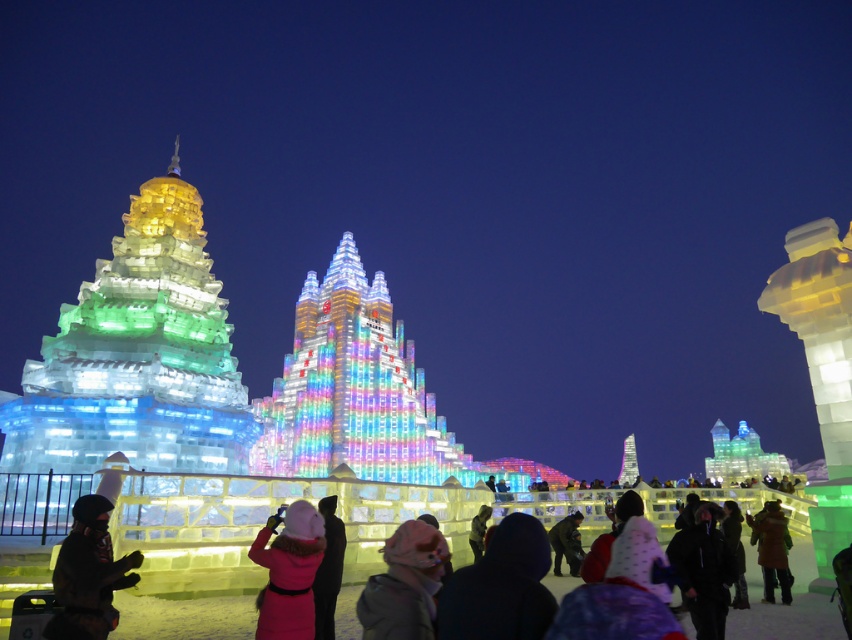
In the scene shown: You are a photographer at the ice festival. You want to capture both the pink woolen hat at center and the green wool coat at center in a single shot. Which object should you focus on first to ensure both are in frame?

The pink woolen hat at center is wider than the green wool coat at center. To ensure both are in frame, focus on the wider object first, which is the pink woolen hat at center, then adjust the camera angle to include the green wool coat at center.

You are a photographer at the ice festival. You want to capture both the pink woolen hat at center and the green wool coat at center in a single shot. Which object should you focus on first to ensure both are in frame?

The pink woolen hat at center is taller than the green wool coat at center, so focusing on the pink woolen hat at center first will help ensure both are captured in the frame.

You are a photographer at the Harbin Ice Festival and want to take a photo that includes both the fuzzy pink hat at center and the pink woolen hat at center. Which hat is shorter so that you can position it closer to the front of the frame without blocking the other?

The fuzzy pink hat at center is shorter than the pink woolen hat at center, so positioning it closer to the front of the frame would prevent it from blocking the taller hat behind it.